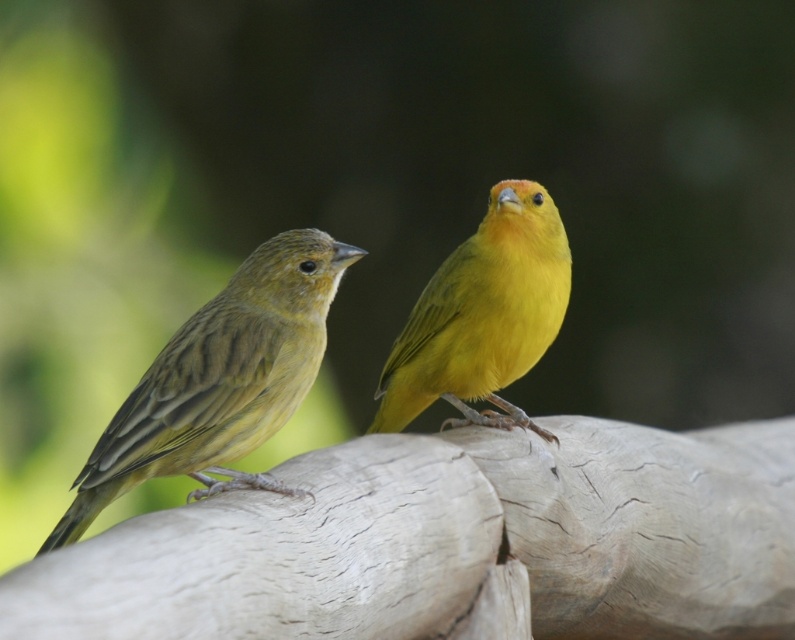
Does matte yellow bird at left lie behind matte yellow canary at center?

No, matte yellow bird at left is in front of matte yellow canary at center.

This screenshot has height=640, width=795. In order to click on matte yellow bird at left in this screenshot , I will do `click(220, 380)`.